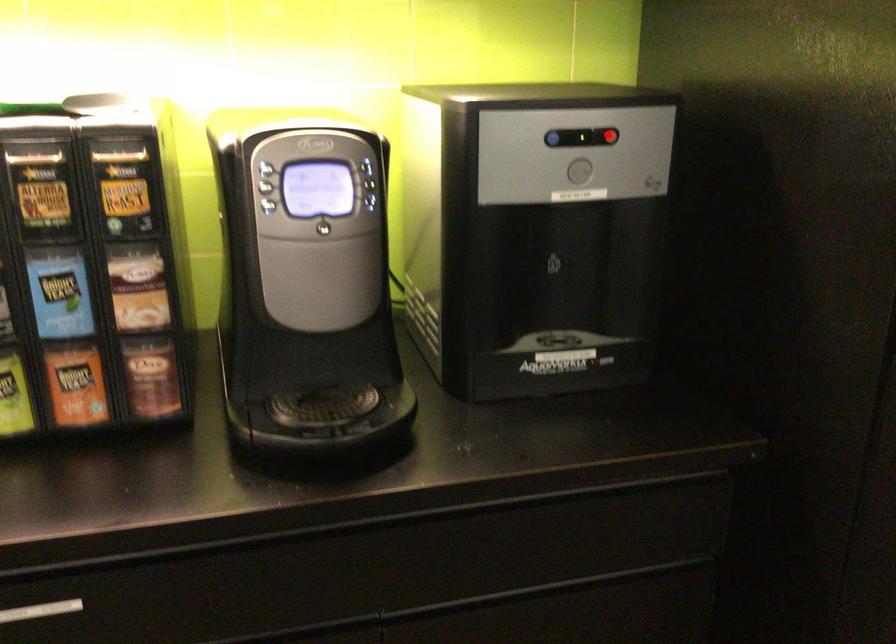
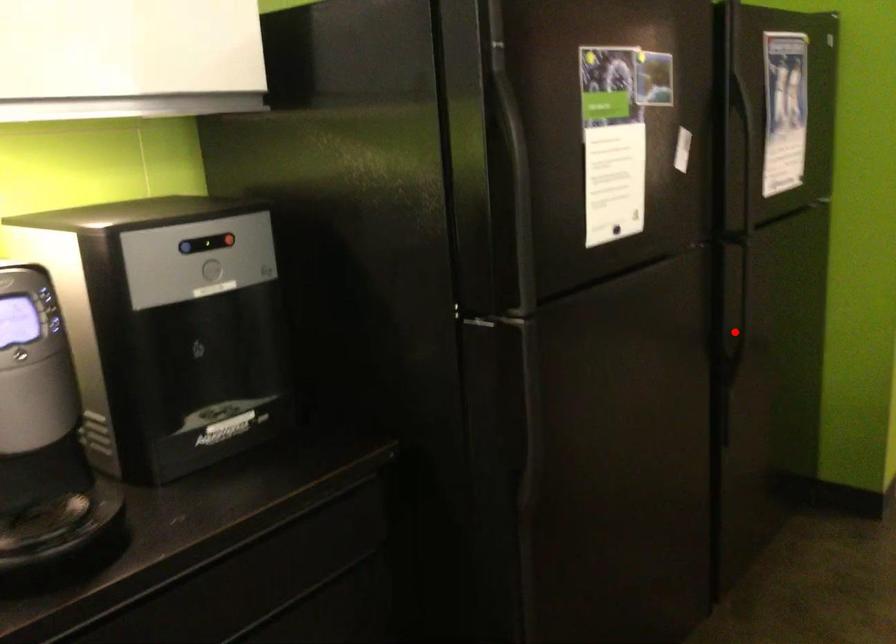
I am providing you with two images of the same scene from different viewpoints. A red point is marked on the first image and another point is marked on the second image. Does the point marked in image1 correspond to the same location as the one in image2?

No